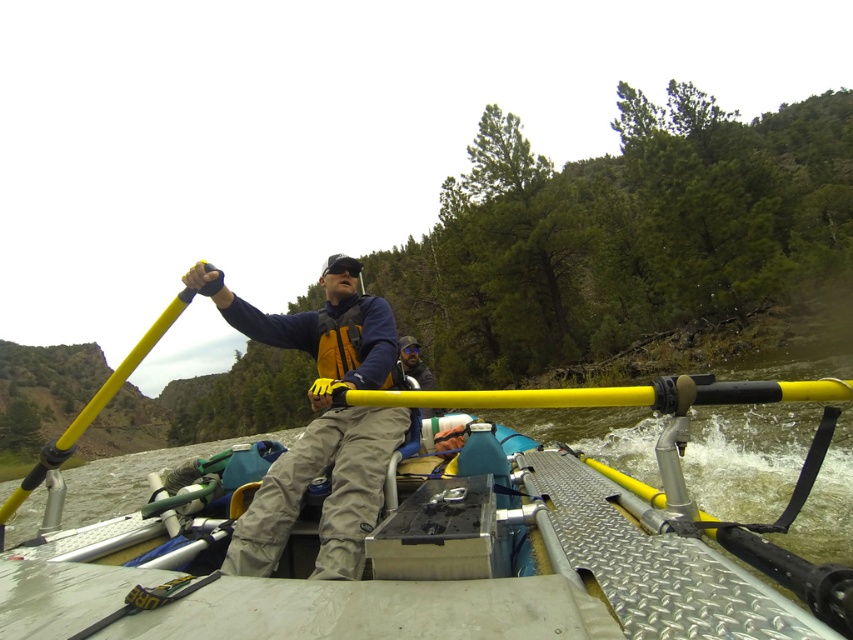
You are on a river raft and need to grab a paddle. There are two options available. The first is the matte yellow paddle at upper left, and the second is the yellow plastic paddle at upper center. Which paddle is positioned higher and easier to reach from your current seated position?

The matte yellow paddle at upper left is positioned higher than the yellow plastic paddle at upper center, so it is easier to reach from your current seated position.

You are on a river rafting trip and need to grab an item. There are two points marked on the raft. Which point is closer to you, point [73,564] or point [787,397]?

Point [73,564] is closer to you because it is further to the camera than point [787,397].